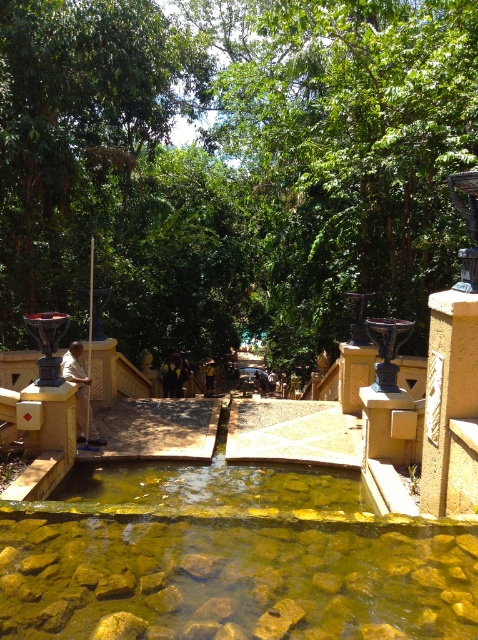
You are standing at the bottom of the stone steps leading through the forest. You want to walk up the steps towards the green leafy tree at center. Which direction should you head in to reach it?

The green leafy tree at center is located at point (232, 166), so you should head towards the center of the steps to reach it.

You are standing on the stone steps and want to walk towards the green leafy tree at center and the clear stone water at center. Which one will you reach first?

You will reach the green leafy tree at center first because it is closer to you than the clear stone water at center.